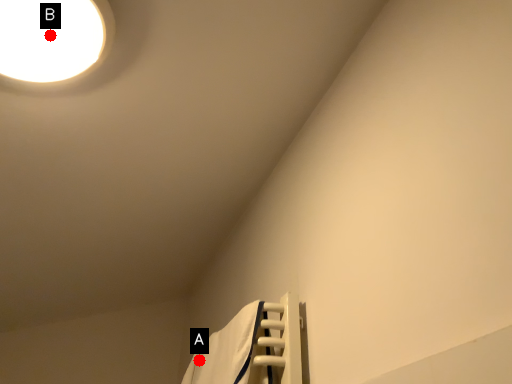
Question: Two points are circled on the image, labeled by A and B beside each circle. Which point appears farthest from the camera in this image?

Choices:
 (A) A is further
 (B) B is further

Answer: (A)